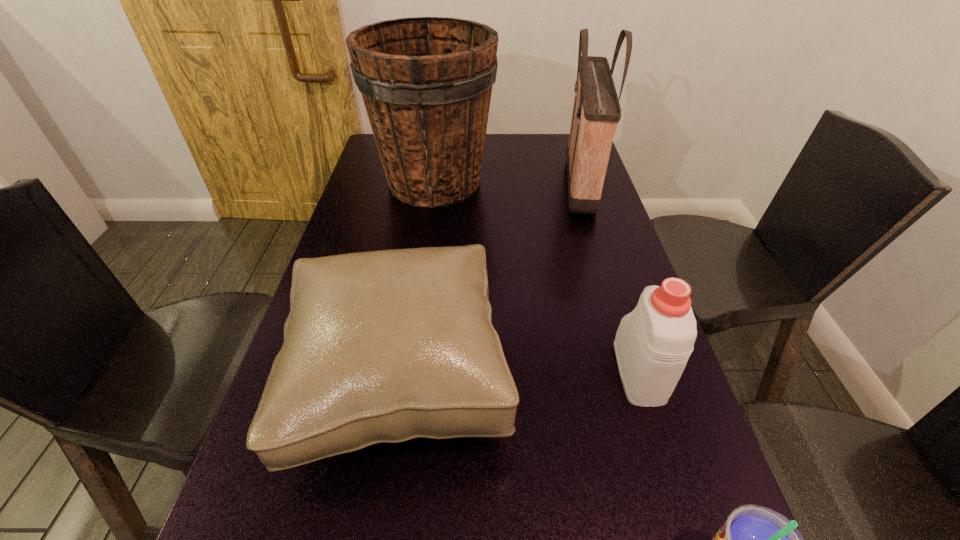
You are a GUI agent. You are given a task and a screenshot of the screen. Output one action in this format:
    pyautogui.click(x=<x>, y=<y>)
    Task: Click on the shopping bag at the far edge
    This screenshot has height=540, width=960.
    Given the screenshot: What is the action you would take?
    pyautogui.click(x=596, y=113)

Image resolution: width=960 pixels, height=540 pixels. In order to click on bucket that is at the far edge in this screenshot , I will do `click(426, 82)`.

At what (x,y) coordinates should I click in order to perform the action: click on bucket present at the left edge. Please return your answer as a coordinate pair (x, y). The width and height of the screenshot is (960, 540). Looking at the image, I should click on (426, 82).

Identify the location of cushion positioned at the left edge. (381, 346).

Locate an element on the screen. shopping bag that is at the right edge is located at coordinates (596, 113).

Locate an element on the screen. Image resolution: width=960 pixels, height=540 pixels. detergent positioned at the right edge is located at coordinates (653, 343).

Locate an element on the screen. This screenshot has height=540, width=960. object present at the far left corner is located at coordinates (426, 82).

In order to click on object that is at the far right corner in this screenshot , I will do `click(596, 113)`.

You are a GUI agent. You are given a task and a screenshot of the screen. Output one action in this format:
    pyautogui.click(x=<x>, y=<y>)
    Task: Click on the vacant space at the left edge of the desktop
    This screenshot has width=960, height=540.
    Given the screenshot: What is the action you would take?
    pyautogui.click(x=347, y=233)

This screenshot has height=540, width=960. I want to click on vacant space at the right edge, so click(x=597, y=354).